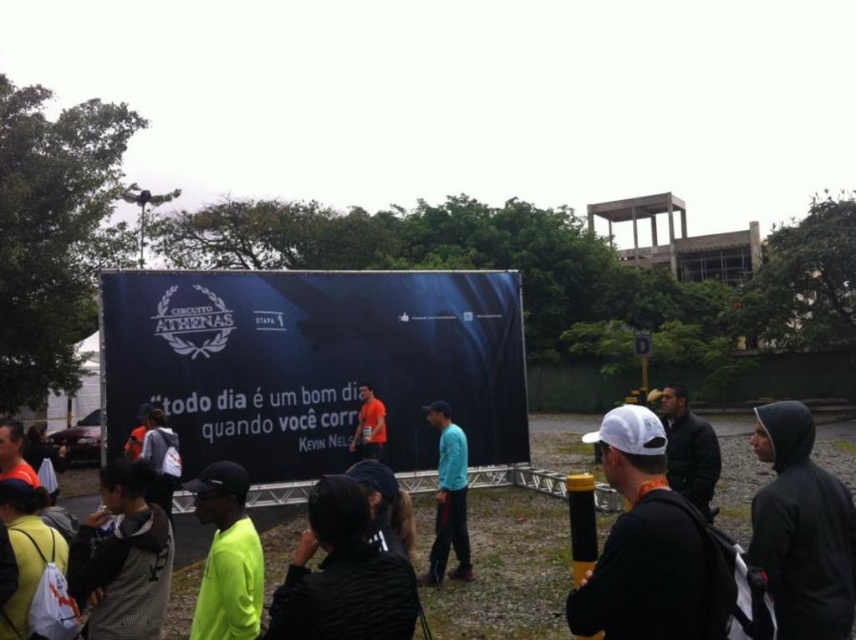
Question: Estimate the real-world distances between objects in this image. Which object is farther from the black fabric at center?

Choices:
 (A) blue matte sign at center
 (B) neon yellow fabric at center

Answer: (A)

Question: Which object is positioned farthest from the black matte jacket at lower right?

Choices:
 (A) black fabric at center
 (B) neon yellow fabric at center

Answer: (B)

Question: Is white matte cap at center to the left of gray textured jacket at lower left from the viewer's perspective?

Choices:
 (A) no
 (B) yes

Answer: (A)

Question: Is dark gray hoodie at center behind matte black backpack at center?

Choices:
 (A) no
 (B) yes

Answer: (A)

Question: Considering the relative positions of black fabric at center and teal matte shirt at center in the image provided, where is black fabric at center located with respect to teal matte shirt at center?

Choices:
 (A) left
 (B) right

Answer: (A)

Question: Which point is closer to the camera taking this photo?

Choices:
 (A) (631, 531)
 (B) (310, 614)

Answer: (A)